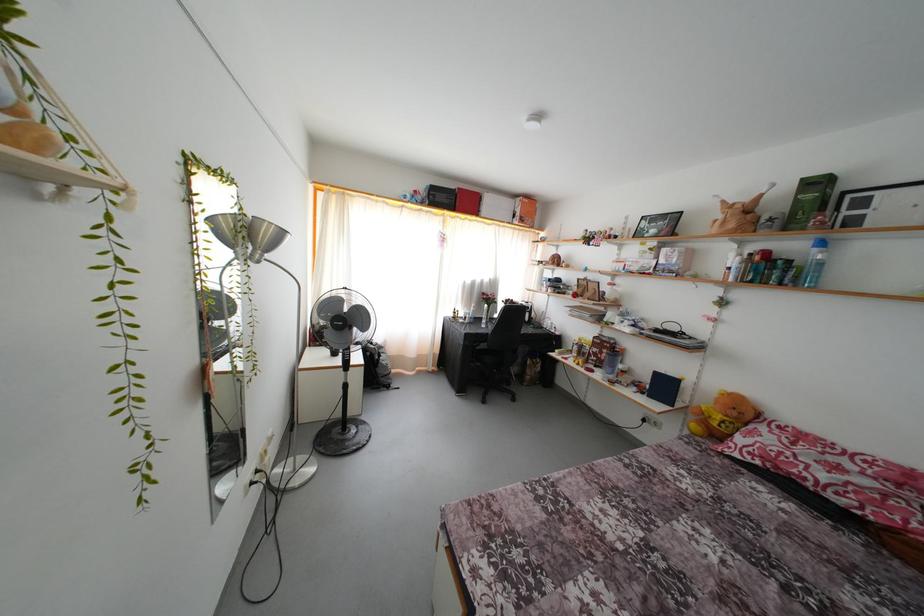
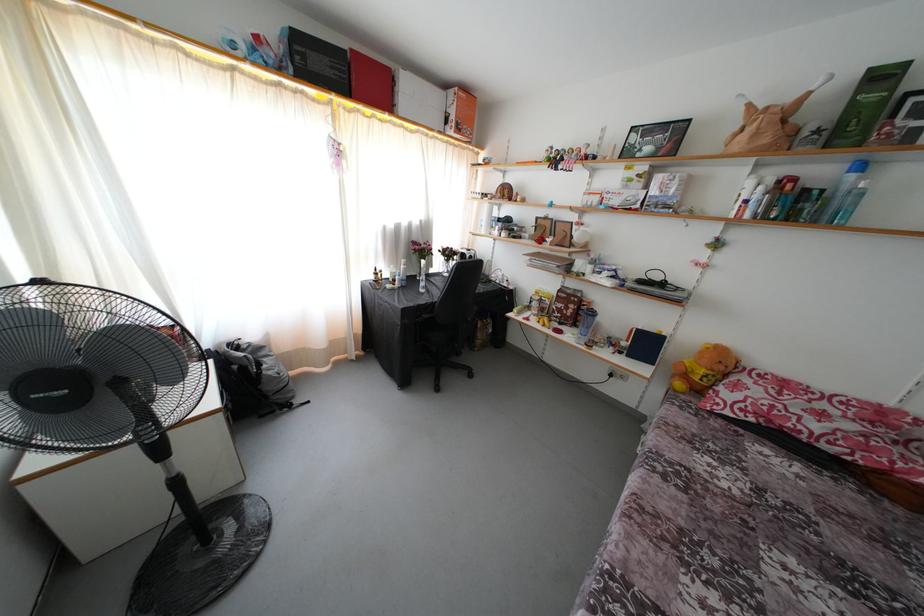
Locate, in the second image, the point that corresponds to [527,225] in the first image.

(463, 134)